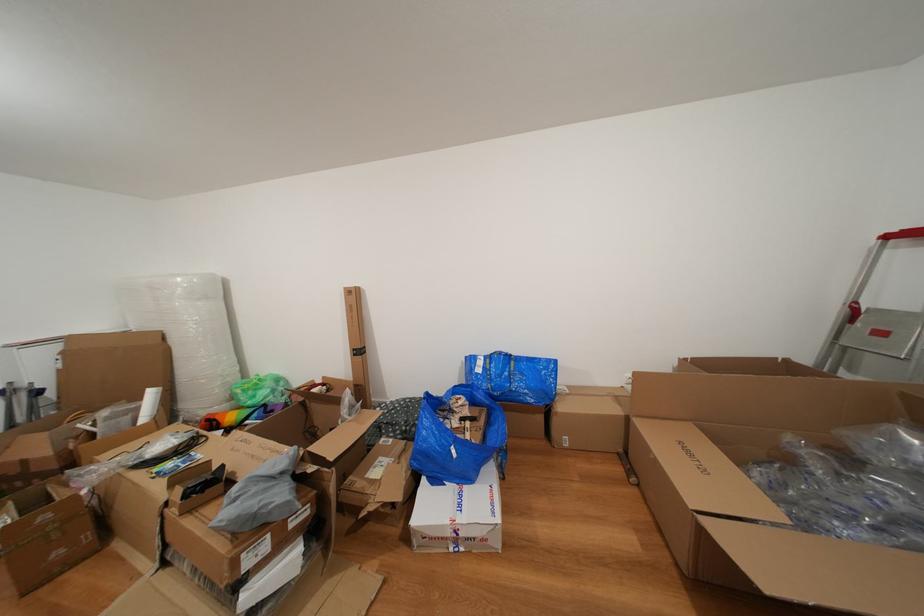
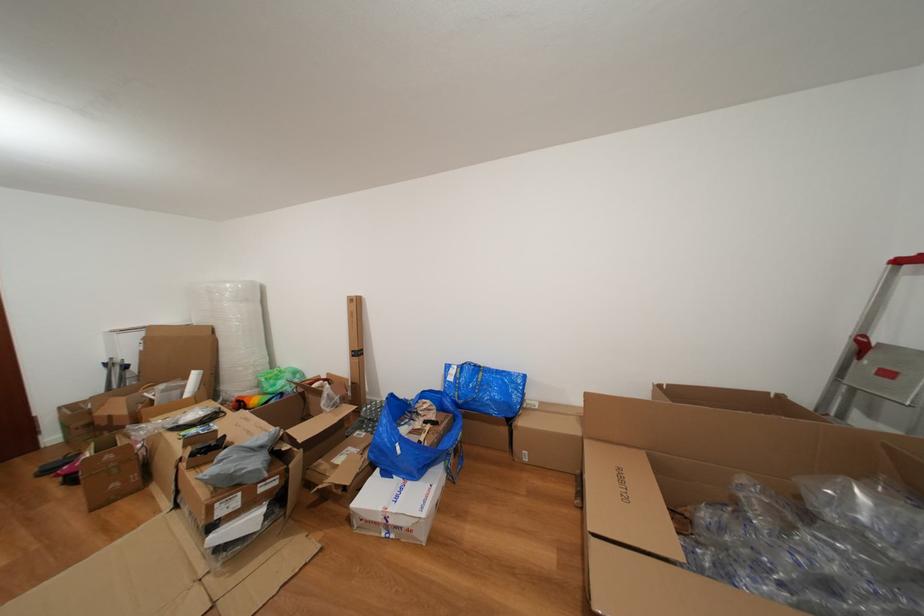
In the second image, find the point that corresponds to (444,485) in the first image.

(394, 479)